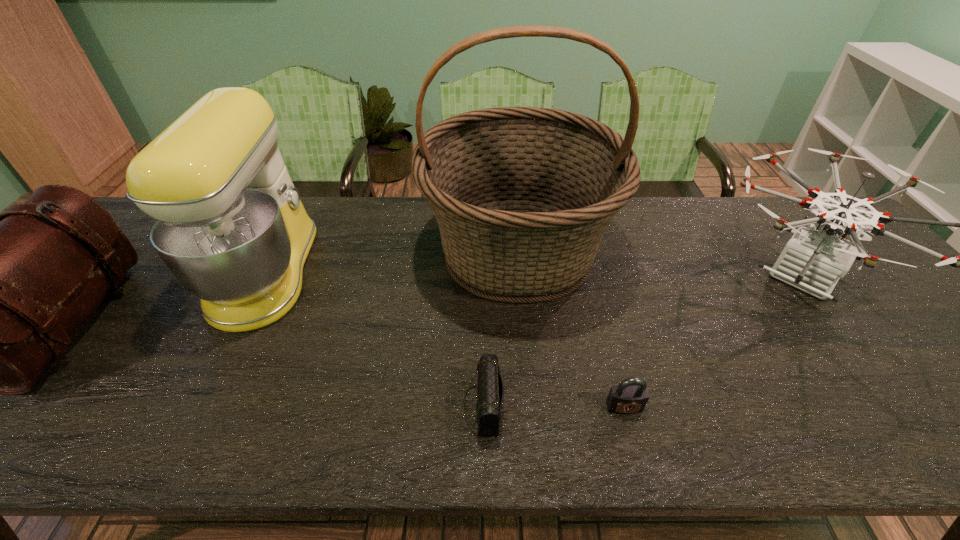
Find the location of `free space that satisfies the following two spatial constraints: 1. on the side of the drone with the control knob; 2. on the left side of the second tallest object`. free space that satisfies the following two spatial constraints: 1. on the side of the drone with the control knob; 2. on the left side of the second tallest object is located at coordinates (264, 278).